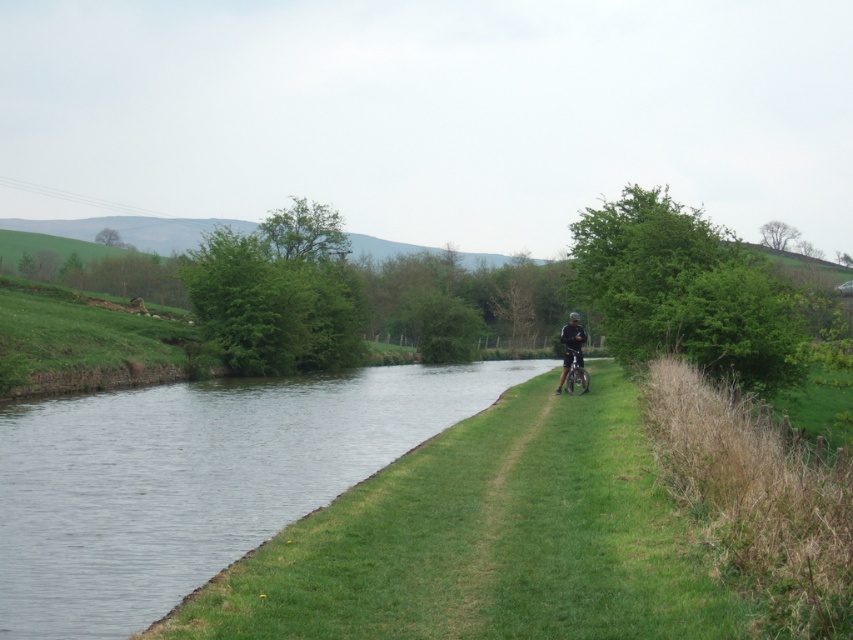
You are a cyclist approaching the scene shown. You notice the clear water at right and the dark blue fabric jacket at center. Which object is located to the left of the other?

The clear water at right is positioned on the left side of dark blue fabric jacket at center, so the clear water at right is to the left of the dark blue fabric jacket at center.

You are a hiker who wants to cross the clear water at right while wearing the dark blue fabric jacket at center. Is the jacket above or below the water?

The clear water at right is below the dark blue fabric jacket at center, so the jacket is above the water.